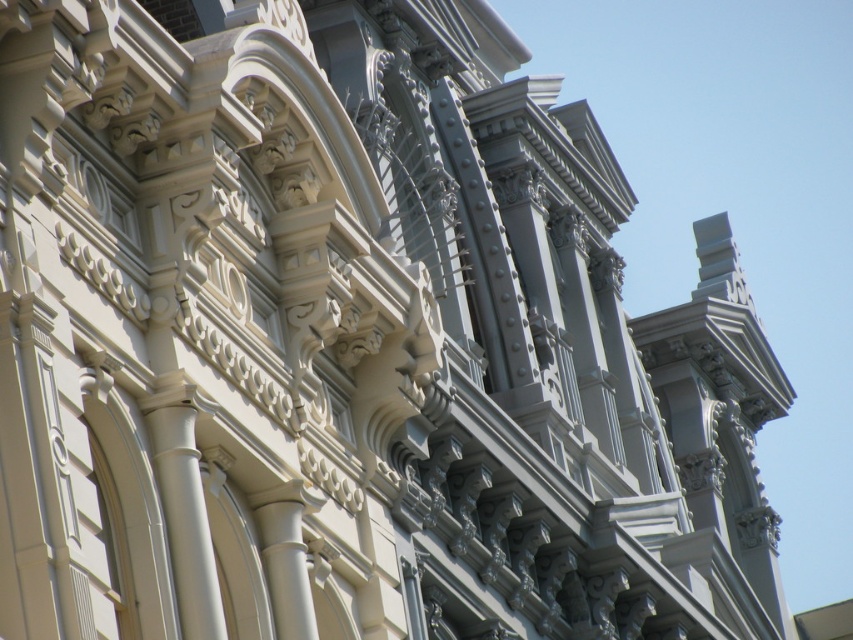
You are an architect examining the facade and want to determine which of the two points, point [178,534] or point [306,612], is nearer to your current position. Based on the architectural details provided, which point is closer?

Point [178,534] is closer to the viewer than point [306,612], so the first point is nearer.

You are an architect inspecting the facade and need to locate the white smooth column at left and the white glossy column at center. Based on their positions, which column is positioned farther to the right?

The white glossy column at center is positioned farther to the right than the white smooth column at left.

You are an architect examining the facade and need to touch both the white smooth column at left and the white glossy column at center. Which column should you reach for first to touch the one closer to you?

You should reach for the white smooth column at left first because it is closer to you than the white glossy column at center.